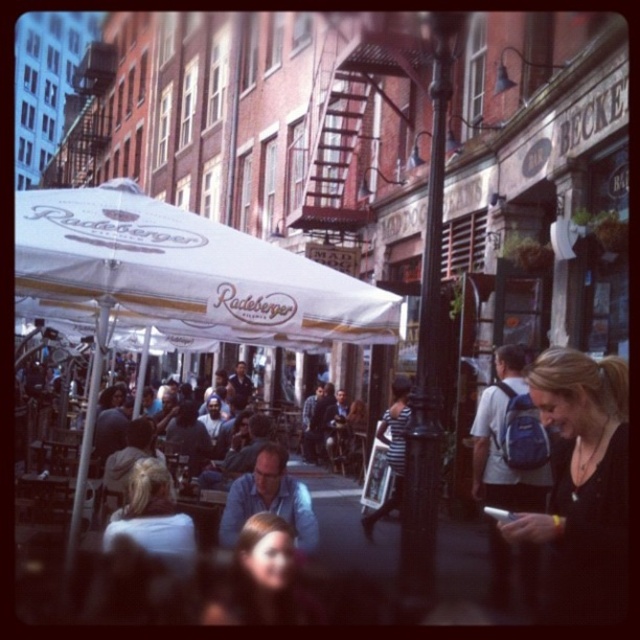
You are a photographer positioned at the edge of the scene. You want to capture a photo of the blonde hair at center without including the white fabric umbrella at center in the frame. Based on their positions, is this possible?

The white fabric umbrella at center is to the right of blonde hair at center, so if you position yourself to the left of the blonde hair at center and aim your camera away from the right side, you can capture the blonde hair at center without including the white fabric umbrella at center in the frame.

You are a street performer who needs to set up a small stage between the white fabric umbrella at center and the black fabric backpack at lower right. Since you need the stage to be as wide as the wider object, which object should you use as a reference for the stage width?

The white fabric umbrella at center has a larger width than the black fabric backpack at lower right, so you should use the white fabric umbrella at center as the reference for the stage width.